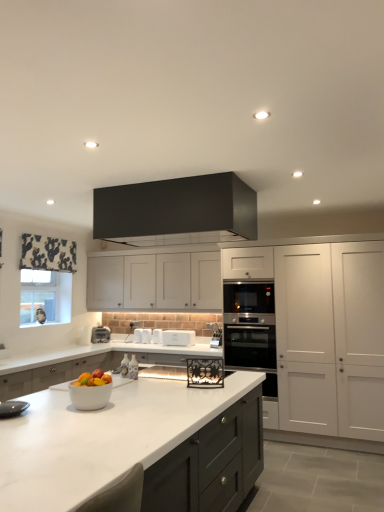
Question: Would you consider satin black oven at right, which is the 1th oven from top to bottom, to be distant from white marble countertop at center?

Choices:
 (A) no
 (B) yes

Answer: (B)

Question: Considering the relative sizes of satin black oven at right, which is the 1th oven from top to bottom, and white marble countertop at center in the image provided, is satin black oven at right, which is the 1th oven from top to bottom, thinner than white marble countertop at center?

Choices:
 (A) yes
 (B) no

Answer: (A)

Question: Is satin black oven at right, which is the 1th oven from top to bottom, wider than white marble countertop at center?

Choices:
 (A) yes
 (B) no

Answer: (B)

Question: Is satin black oven at right, which is the 1th oven from top to bottom, aimed at white marble countertop at center?

Choices:
 (A) no
 (B) yes

Answer: (A)

Question: Considering the relative sizes of satin black oven at right, which is the 1th oven from top to bottom, and white marble countertop at center in the image provided, is satin black oven at right, which is the 1th oven from top to bottom, bigger than white marble countertop at center?

Choices:
 (A) no
 (B) yes

Answer: (A)

Question: Is white matte toaster at center, which ranks as the 1th appliance in left-to-right order, wider or thinner than satin black oven at center, the 1th appliance in the right-to-left sequence?

Choices:
 (A) thin
 (B) wide

Answer: (A)

Question: Considering the positions of point (94, 340) and point (211, 326), is point (94, 340) closer or farther from the camera than point (211, 326)?

Choices:
 (A) farther
 (B) closer

Answer: (A)

Question: Looking at the image, does white matte toaster at center, which ranks as the 1th appliance in left-to-right order, seem bigger or smaller compared to satin black oven at center, which is counted as the fourth appliance, starting from the left?

Choices:
 (A) small
 (B) big

Answer: (A)

Question: From their relative heights in the image, would you say white matte toaster at center, which ranks as the 1th appliance in left-to-right order, is taller or shorter than satin black oven at center, which is counted as the fourth appliance, starting from the left?

Choices:
 (A) tall
 (B) short

Answer: (B)

Question: From the image's perspective, is white matte cabinet at right, the second cabinetry viewed from the front, located above or below shiny plastic bowl at center?

Choices:
 (A) below
 (B) above

Answer: (A)

Question: In terms of height, does white matte cabinet at right, the second cabinetry viewed from the front, look taller or shorter compared to shiny plastic bowl at center?

Choices:
 (A) tall
 (B) short

Answer: (A)

Question: Would you say white matte cabinet at right, the second cabinetry viewed from the front, is to the left or to the right of shiny plastic bowl at center in the picture?

Choices:
 (A) right
 (B) left

Answer: (A)

Question: Is white matte cabinet at right, the 2th cabinetry in the back-to-front sequence, wider or thinner than shiny plastic bowl at center?

Choices:
 (A) thin
 (B) wide

Answer: (B)

Question: Is white plastic toaster at center wider or thinner than white matte cabinet at center, the first cabinetry in the back-to-front sequence?

Choices:
 (A) thin
 (B) wide

Answer: (A)

Question: From the image's perspective, is white plastic toaster at center located above or below white matte cabinet at center, which ranks as the 3th cabinetry in front-to-back order?

Choices:
 (A) above
 (B) below

Answer: (B)